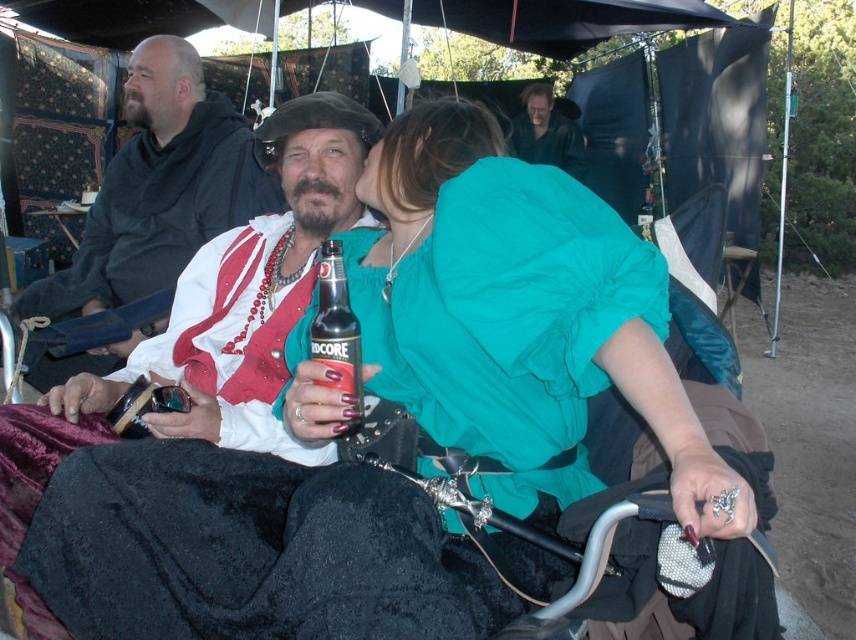
Question: Which point appears farthest from the camera in this image?

Choices:
 (A) (113, 186)
 (B) (349, 337)

Answer: (A)

Question: Which object is farther from the camera taking this photo?

Choices:
 (A) white fabric shirt at center
 (B) smooth black shirt at upper center
 (C) shiny leather jacket at center
 (D) black glass bottle at center

Answer: (B)

Question: Does shiny leather jacket at center lie behind black glass bottle at center?

Choices:
 (A) no
 (B) yes

Answer: (B)

Question: Considering the relative positions of shiny leather jacket at center and black glass bottle at center in the image provided, where is shiny leather jacket at center located with respect to black glass bottle at center?

Choices:
 (A) below
 (B) above

Answer: (B)

Question: Considering the real-world distances, which object is closest to the white fabric shirt at center?

Choices:
 (A) black glass bottle at center
 (B) shiny leather jacket at center

Answer: (B)

Question: Does shiny leather jacket at center appear on the right side of white fabric shirt at center?

Choices:
 (A) no
 (B) yes

Answer: (B)